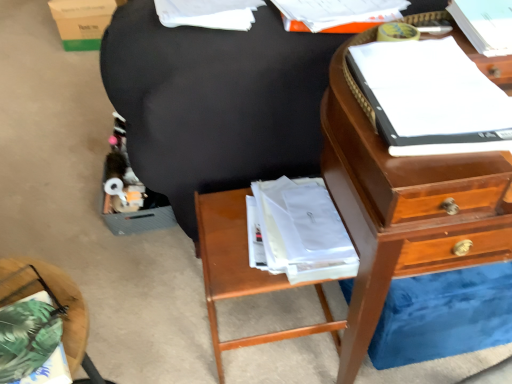
Question: From a real-world perspective, is wooden nightstand at lower center, which ranks as the second nightstand in left-to-right order, above or below white paper at upper center, the third book in the right-to-left sequence?

Choices:
 (A) below
 (B) above

Answer: (A)

Question: Is wooden nightstand at lower center, positioned as the first nightstand in back-to-front order, inside the boundaries of white paper at upper center, marked as the first book in a left-to-right arrangement, or outside?

Choices:
 (A) inside
 (B) outside

Answer: (B)

Question: Estimate the real-world distances between objects in this image. Which object is farther from the wooden nightstand at lower center, positioned as the first nightstand in back-to-front order?

Choices:
 (A) black fabric bean bag chair at center
 (B) green fabric pillow at lower left, the second nightstand in the right-to-left sequence
 (C) white paper at upper right, marked as the 1th book in a right-to-left arrangement
 (D) white paper at upper center, marked as the first book in a left-to-right arrangement
 (E) white paper at upper right, which is the second book in right-to-left order

Answer: (C)

Question: Based on their relative distances, which object is nearer to the white paper at upper center, marked as the first book in a left-to-right arrangement?

Choices:
 (A) white paper at upper right, which is counted as the 3th book, starting from the left
 (B) wooden nightstand at lower center, which is the second nightstand from front to back
 (C) green cardboard box at upper left
 (D) white paper at upper right, marked as the 2th book in a left-to-right arrangement
 (E) green fabric pillow at lower left, the first nightstand from the front

Answer: (D)